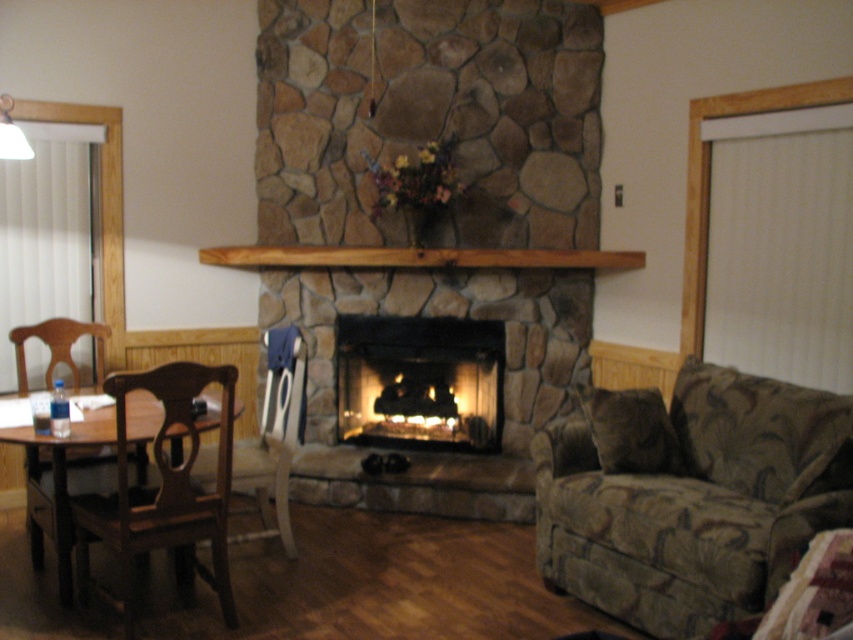
Question: Which point is closer to the camera?

Choices:
 (A) (494, 323)
 (B) (135, 445)

Answer: (B)

Question: Does brown floral fabric couch at lower right lie behind brown wood mantle at center?

Choices:
 (A) no
 (B) yes

Answer: (A)

Question: Does smooth stone fireplace at center have a smaller size compared to brown fabric chair at left?

Choices:
 (A) yes
 (B) no

Answer: (B)

Question: Can you confirm if smooth stone fireplace at center is positioned above brown wood mantle at center?

Choices:
 (A) yes
 (B) no

Answer: (B)

Question: Which object is positioned farthest from the brown fabric chair at left?

Choices:
 (A) brown floral fabric couch at lower right
 (B) brown wooden table at lower left
 (C) brown wood mantle at center

Answer: (A)

Question: Which point appears closest to the camera in this image?

Choices:
 (A) tap(556, 250)
 (B) tap(97, 372)
 (C) tap(245, 454)

Answer: (C)